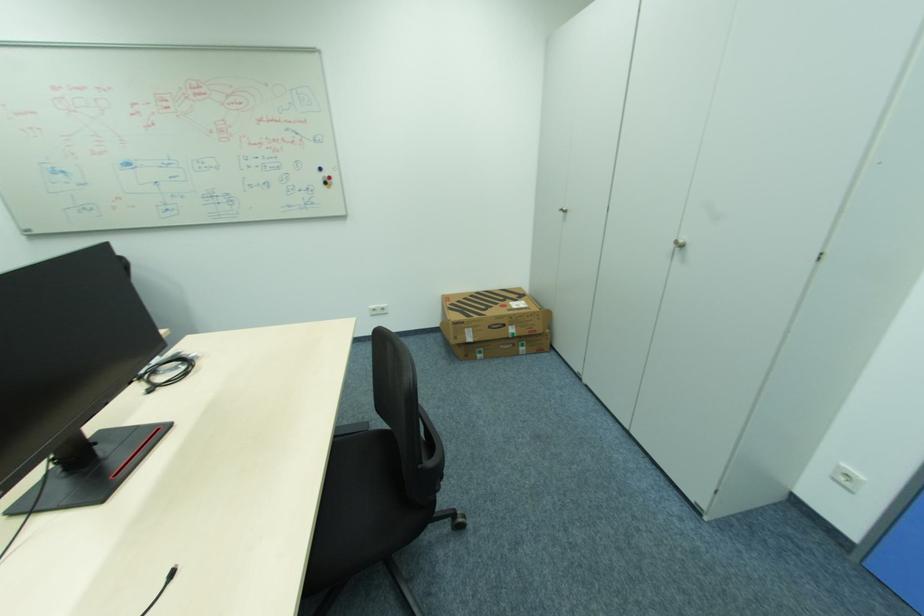
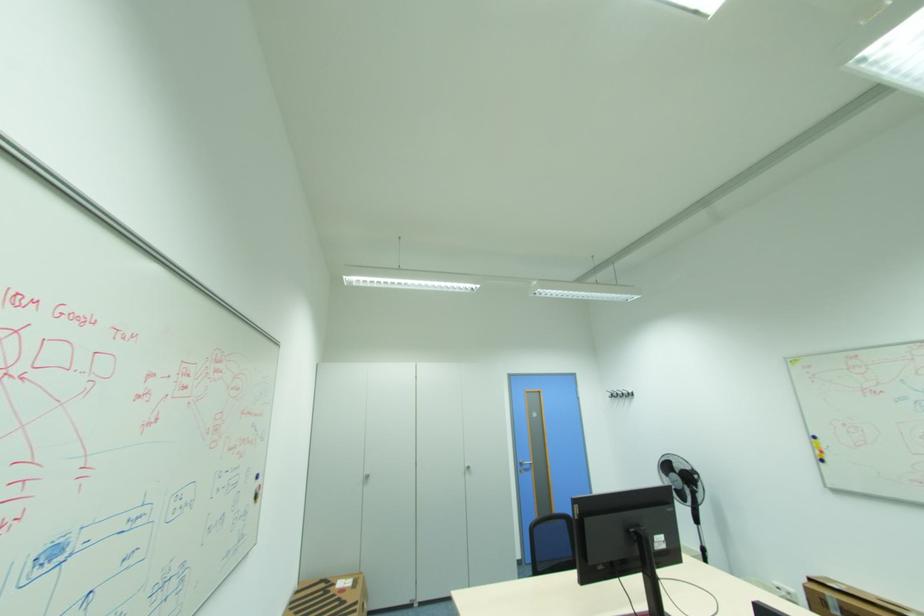
Find the pixel in the second image that matches (x=569, y=212) in the first image.

(372, 477)